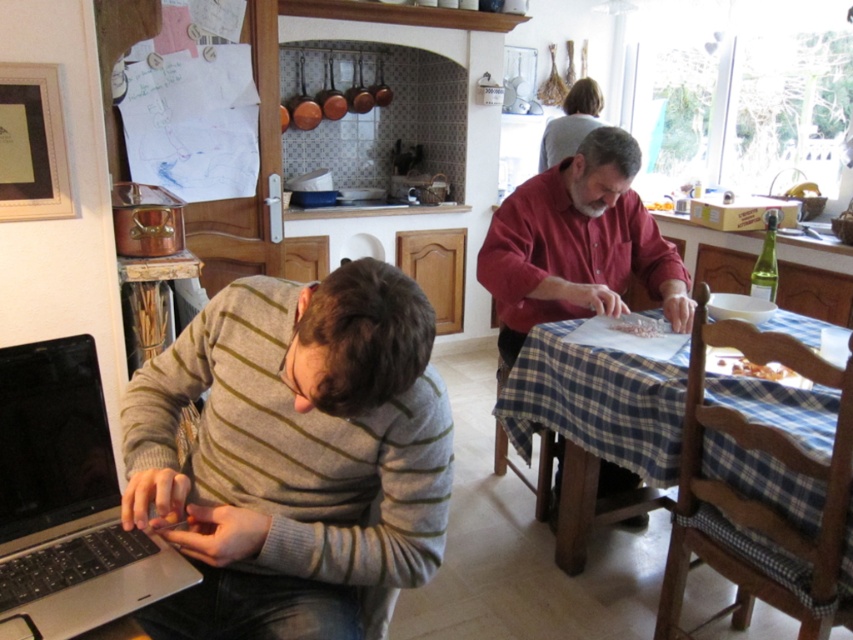
Consider the image. Who is more distant from viewer, (608, 129) or (560, 124)?

The point (560, 124) is more distant.

Does red matte shirt at center appear under light gray sweater at upper center?

Indeed, red matte shirt at center is positioned under light gray sweater at upper center.

Where is `red matte shirt at center`? This screenshot has height=640, width=853. red matte shirt at center is located at coordinates (578, 244).

Is the position of silver metallic laptop at lower left more distant than that of blue checkered tablecloth at center?

No.

Is point (77, 500) positioned after point (811, 433)?

No.

Is point (22, 524) positioned before point (770, 416)?

Yes.

The image size is (853, 640). I want to click on silver metallic laptop at lower left, so click(x=67, y=500).

Who is lower down, blue checkered tablecloth at center or red matte shirt at center?

blue checkered tablecloth at center

Does blue checkered tablecloth at center have a lesser width compared to red matte shirt at center?

No.

Where is `blue checkered tablecloth at center`? The height and width of the screenshot is (640, 853). blue checkered tablecloth at center is located at coordinates (598, 403).